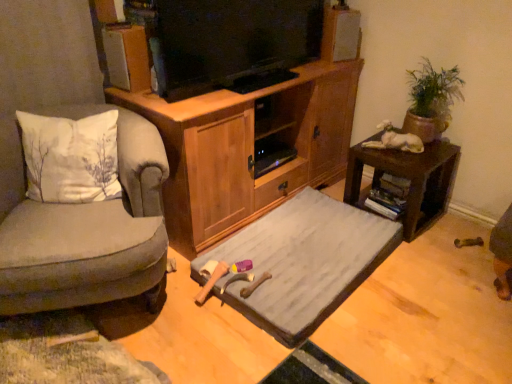
Locate an element on the screen. free space in front of brown wooden desk at right is located at coordinates (435, 259).